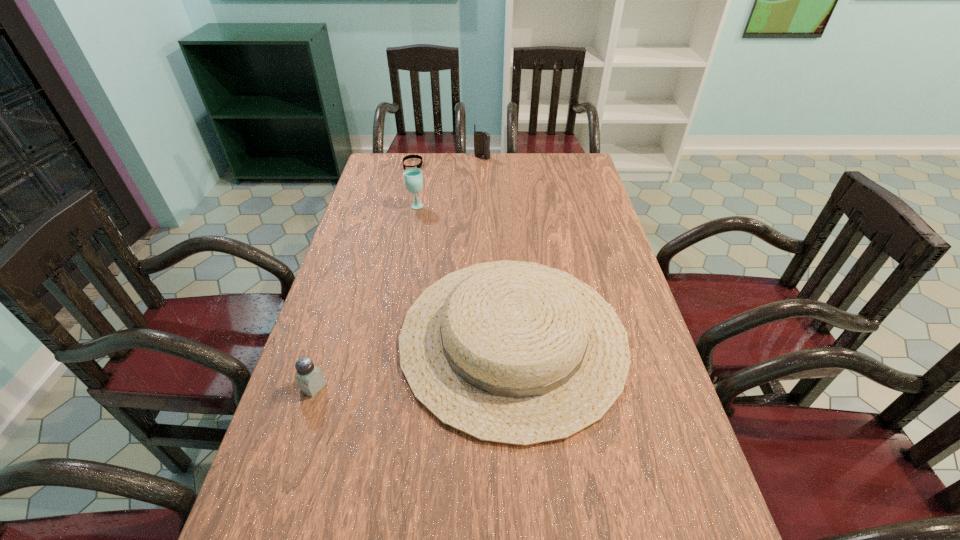
Identify the location of cellular telephone. The width and height of the screenshot is (960, 540). (481, 139).

Find the location of a particular element. Image resolution: width=960 pixels, height=540 pixels. the third farthest object is located at coordinates (413, 178).

Where is `the third shortest object`? This screenshot has height=540, width=960. the third shortest object is located at coordinates [x=511, y=352].

The image size is (960, 540). In order to click on saltshaker in this screenshot , I will do `click(310, 379)`.

You are a GUI agent. You are given a task and a screenshot of the screen. Output one action in this format:
    pyautogui.click(x=<x>, y=<y>)
    Task: Click on the fourth tallest object
    This screenshot has width=960, height=540.
    Given the screenshot: What is the action you would take?
    pyautogui.click(x=310, y=379)

You are a GUI agent. You are given a task and a screenshot of the screen. Output one action in this format:
    pyautogui.click(x=<x>, y=<y>)
    Task: Click on the wristband
    The image size is (960, 540).
    Given the screenshot: What is the action you would take?
    pyautogui.click(x=419, y=165)

Image resolution: width=960 pixels, height=540 pixels. I want to click on vacant space located 0.240m on the keyboard of the cellular telephone, so click(x=482, y=192).

Where is `free space located on the back of the third farthest object`? This screenshot has height=540, width=960. free space located on the back of the third farthest object is located at coordinates (424, 164).

The width and height of the screenshot is (960, 540). Identify the location of free region located 0.180m on the back of the sunhat. (505, 228).

The image size is (960, 540). In order to click on free space located on the back of the leftmost object in this screenshot , I will do `click(347, 284)`.